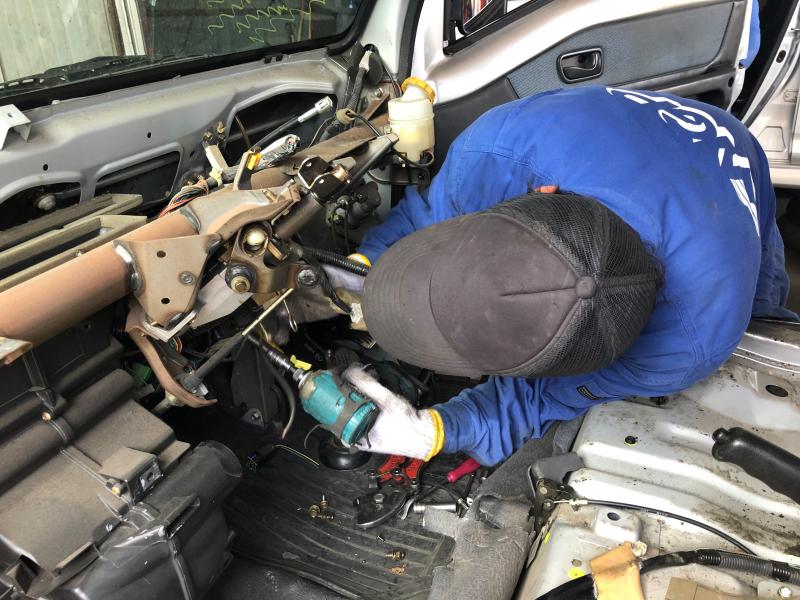
Find the location of a particular element. floor mat is located at coordinates (280, 524).